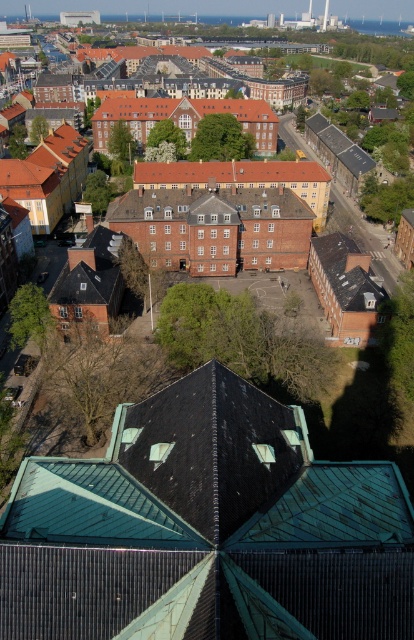
Question: Is green copper roof at center to the right of red tile roof at center from the viewer's perspective?

Choices:
 (A) yes
 (B) no

Answer: (B)

Question: Which is nearer to the brown brick building at center?

Choices:
 (A) red tile roof at center
 (B) green copper roof at center
 (C) brown matte building at center

Answer: (A)

Question: Is green copper roof at center further to camera compared to red tile roof at center?

Choices:
 (A) yes
 (B) no

Answer: (B)

Question: Which object appears farthest from the camera in this image?

Choices:
 (A) brown brick building at center
 (B) brown matte building at center

Answer: (B)

Question: Does green copper roof at center appear on the left side of brown matte building at center?

Choices:
 (A) yes
 (B) no

Answer: (B)

Question: Among these points, which one is farthest from the camera?

Choices:
 (A) (134, 209)
 (B) (100, 144)
 (C) (165, 173)

Answer: (B)